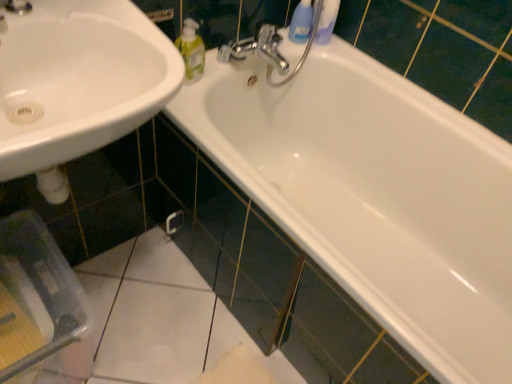
Locate an element on the screen. Image resolution: width=512 pixels, height=384 pixels. white glossy bathtub at upper center is located at coordinates (375, 196).

At what (x,y) coordinates should I click in order to perform the action: click on translucent plastic bottle at upper center. Please return your answer as a coordinate pair (x, y). The image size is (512, 384). Looking at the image, I should click on (301, 22).

The width and height of the screenshot is (512, 384). Find the location of `white glossy bathtub at upper center`. white glossy bathtub at upper center is located at coordinates (375, 196).

Is white glossy sink at lower left aimed at translucent plastic bottle at upper center?

No, white glossy sink at lower left is not aimed at translucent plastic bottle at upper center.

Between white glossy sink at lower left and translucent plastic bottle at upper center, which one has larger width?

white glossy sink at lower left.

Considering the sizes of objects white glossy sink at lower left and translucent plastic bottle at upper center in the image provided, who is smaller, white glossy sink at lower left or translucent plastic bottle at upper center?

Smaller between the two is translucent plastic bottle at upper center.

Is chrome metallic faucet at upper center oriented towards translucent plastic bottle at upper center?

No, chrome metallic faucet at upper center is not turned towards translucent plastic bottle at upper center.

What's the angular difference between chrome metallic faucet at upper center and translucent plastic bottle at upper center's facing directions?

The facing directions of chrome metallic faucet at upper center and translucent plastic bottle at upper center are 1.24 degrees apart.

Is chrome metallic faucet at upper center wider or thinner than translucent plastic bottle at upper center?

chrome metallic faucet at upper center is wider than translucent plastic bottle at upper center.

Considering the sizes of objects chrome metallic faucet at upper center and translucent plastic bottle at upper center in the image provided, who is taller, chrome metallic faucet at upper center or translucent plastic bottle at upper center?

chrome metallic faucet at upper center is taller.

Considering the sizes of translucent plastic bottle at upper center and white glossy bathtub at upper center in the image, is translucent plastic bottle at upper center taller or shorter than white glossy bathtub at upper center?

In the image, translucent plastic bottle at upper center appears to be shorter than white glossy bathtub at upper center.

Is translucent plastic bottle at upper center wider or thinner than white glossy bathtub at upper center?

Considering their sizes, translucent plastic bottle at upper center looks slimmer than white glossy bathtub at upper center.

Is translucent plastic bottle at upper center facing towards white glossy bathtub at upper center?

No, translucent plastic bottle at upper center does not turn towards white glossy bathtub at upper center.

Could white glossy sink at lower left be considered to be inside chrome metallic faucet at upper center?

No, white glossy sink at lower left is not a part of chrome metallic faucet at upper center.

From the image's perspective, is chrome metallic faucet at upper center above or below white glossy sink at lower left?

Clearly, from the image's perspective, chrome metallic faucet at upper center is above white glossy sink at lower left.

Considering the sizes of chrome metallic faucet at upper center and white glossy sink at lower left in the image, is chrome metallic faucet at upper center bigger or smaller than white glossy sink at lower left?

chrome metallic faucet at upper center is smaller than white glossy sink at lower left.

Which of these two, chrome metallic faucet at upper center or white glossy sink at lower left, stands taller?

With more height is white glossy sink at lower left.

Could white glossy sink at lower left be considered to be inside translucent plastic bottle at upper center?

No, white glossy sink at lower left is not inside translucent plastic bottle at upper center.

In the scene shown: Can you confirm if translucent plastic bottle at upper center is thinner than white glossy sink at lower left?

Indeed, translucent plastic bottle at upper center has a lesser width compared to white glossy sink at lower left.

Considering the relative positions of translucent plastic bottle at upper center and white glossy sink at lower left in the image provided, is translucent plastic bottle at upper center behind white glossy sink at lower left?

Yes, it is.

From a real-world perspective, which object stands above the other?

white glossy sink at lower left, from a real-world perspective.

Would you say white glossy sink at lower left is a long distance from white glossy bathtub at upper center?

No, there isn't a large distance between white glossy sink at lower left and white glossy bathtub at upper center.

In terms of width, does white glossy sink at lower left look wider or thinner when compared to white glossy bathtub at upper center?

In the image, white glossy sink at lower left appears to be more narrow than white glossy bathtub at upper center.

Consider the image. Is white glossy bathtub at upper center smaller than chrome metallic faucet at upper center?

Actually, white glossy bathtub at upper center might be larger than chrome metallic faucet at upper center.

Which is correct: white glossy bathtub at upper center is inside chrome metallic faucet at upper center, or outside of it?

white glossy bathtub at upper center is outside chrome metallic faucet at upper center.

At what (x,y) coordinates should I click in order to perform the action: click on plumbing fixture located behind the white glossy bathtub at upper center. Please return your answer as a coordinate pair (x, y). This screenshot has width=512, height=384. Looking at the image, I should click on (269, 48).

Is white glossy bathtub at upper center turned away from chrome metallic faucet at upper center?

white glossy bathtub at upper center is not turned away from chrome metallic faucet at upper center.

At what (x,y) coordinates should I click in order to perform the action: click on sink on the left of translucent plastic bottle at upper center. Please return your answer as a coordinate pair (x, y). Image resolution: width=512 pixels, height=384 pixels. Looking at the image, I should click on (78, 80).

Where is `cleaning product behind the chrome metallic faucet at upper center`? cleaning product behind the chrome metallic faucet at upper center is located at coordinates (301, 22).

Based on their spatial positions, is chrome metallic faucet at upper center or white glossy bathtub at upper center further from translucent plastic bottle at upper center?

white glossy bathtub at upper center.

When comparing their distances from white glossy sink at lower left, does chrome metallic faucet at upper center or white glossy bathtub at upper center seem further?

white glossy bathtub at upper center lies further to white glossy sink at lower left than the other object.

From the image, which object appears to be nearer to chrome metallic faucet at upper center, white glossy sink at lower left or white glossy bathtub at upper center?

The object closer to chrome metallic faucet at upper center is white glossy bathtub at upper center.

Based on their spatial positions, is translucent plastic bottle at upper center or white glossy sink at lower left closer to chrome metallic faucet at upper center?

Based on the image, translucent plastic bottle at upper center appears to be nearer to chrome metallic faucet at upper center.

Looking at this image, considering their positions, is chrome metallic faucet at upper center positioned further to white glossy bathtub at upper center than white glossy sink at lower left?

white glossy sink at lower left is further to white glossy bathtub at upper center.

Estimate the real-world distances between objects in this image. Which object is closer to translucent plastic bottle at upper center, white glossy bathtub at upper center or chrome metallic faucet at upper center?

chrome metallic faucet at upper center is positioned closer to the anchor translucent plastic bottle at upper center.

From the image, which object appears to be farther from white glossy sink at lower left, translucent plastic bottle at upper center or white glossy bathtub at upper center?

The object further to white glossy sink at lower left is translucent plastic bottle at upper center.

From the image, which object appears to be nearer to white glossy sink at lower left, translucent plastic bottle at upper center or chrome metallic faucet at upper center?

Based on the image, chrome metallic faucet at upper center appears to be nearer to white glossy sink at lower left.

What are the coordinates of `plumbing fixture located between white glossy bathtub at upper center and translucent plastic bottle at upper center in the depth direction` in the screenshot? It's located at (269, 48).

I want to click on plumbing fixture between white glossy sink at lower left and translucent plastic bottle at upper center along the z-axis, so click(x=269, y=48).

You are a GUI agent. You are given a task and a screenshot of the screen. Output one action in this format:
    pyautogui.click(x=<x>, y=<y>)
    Task: Click on the plumbing fixture between white glossy sink at lower left and white glossy bathtub at upper center in the horizontal direction
    Image resolution: width=512 pixels, height=384 pixels.
    Given the screenshot: What is the action you would take?
    pyautogui.click(x=269, y=48)

Where is `bathtub between white glossy sink at lower left and translucent plastic bottle at upper center in the front-back direction`? The width and height of the screenshot is (512, 384). bathtub between white glossy sink at lower left and translucent plastic bottle at upper center in the front-back direction is located at coordinates (375, 196).